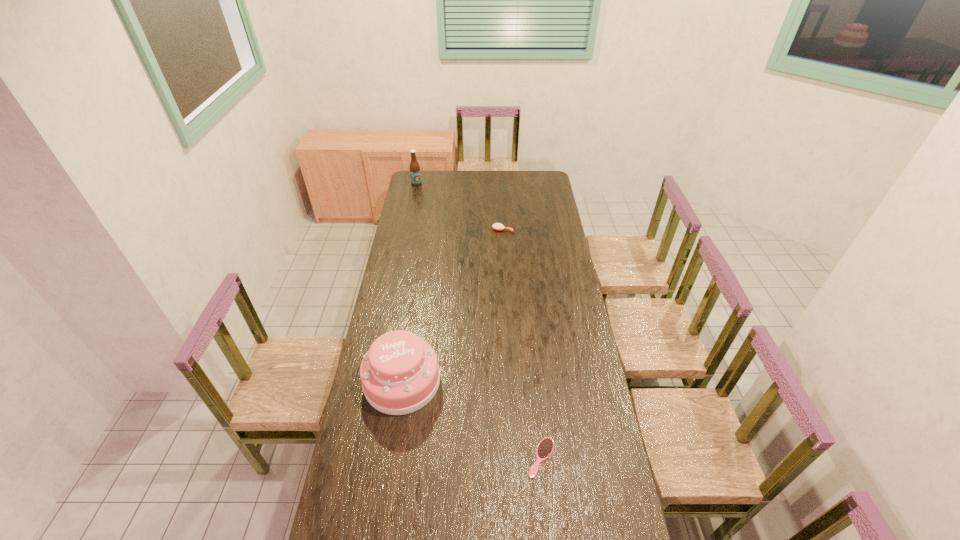
This screenshot has width=960, height=540. What are the coordinates of `free space that satisfies the following two spatial constraints: 1. on the front side of the shorter hairbrush; 2. on the left side of the taller hairbrush` in the screenshot? It's located at (516, 457).